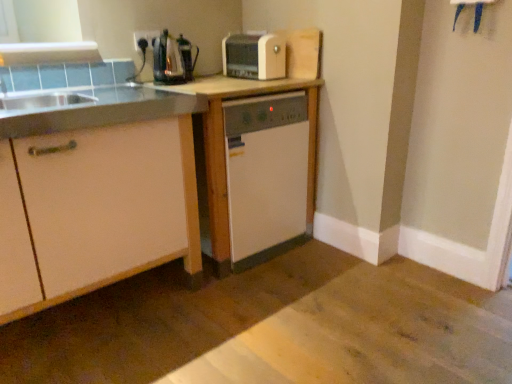
Question: Can you confirm if white wood table at center is thinner than matte plastic outlet at upper left?

Choices:
 (A) yes
 (B) no

Answer: (B)

Question: From a real-world perspective, is white wood table at center positioned under matte plastic outlet at upper left based on gravity?

Choices:
 (A) yes
 (B) no

Answer: (A)

Question: From a real-world perspective, does white wood table at center stand above matte plastic outlet at upper left?

Choices:
 (A) yes
 (B) no

Answer: (B)

Question: Is white wood table at center wider than matte plastic outlet at upper left?

Choices:
 (A) no
 (B) yes

Answer: (B)

Question: Is white wood table at center next to matte plastic outlet at upper left and touching it?

Choices:
 (A) no
 (B) yes

Answer: (A)

Question: Is matte plastic outlet at upper left completely or partially inside white wood table at center?

Choices:
 (A) no
 (B) yes

Answer: (A)

Question: Does satin silver coffee machine at upper center have a greater width compared to white wood table at center?

Choices:
 (A) yes
 (B) no

Answer: (B)

Question: Is satin silver coffee machine at upper center to the right of white wood table at center from the viewer's perspective?

Choices:
 (A) yes
 (B) no

Answer: (B)

Question: Is satin silver coffee machine at upper center taller than white wood table at center?

Choices:
 (A) yes
 (B) no

Answer: (B)

Question: From the image's perspective, is satin silver coffee machine at upper center located beneath white wood table at center?

Choices:
 (A) yes
 (B) no

Answer: (B)

Question: Does satin silver coffee machine at upper center contain white wood table at center?

Choices:
 (A) no
 (B) yes

Answer: (A)

Question: Can you confirm if satin silver coffee machine at upper center is positioned to the left of white wood table at center?

Choices:
 (A) no
 (B) yes

Answer: (B)

Question: Is white matte cabinet at left behind matte plastic outlet at upper left?

Choices:
 (A) no
 (B) yes

Answer: (A)